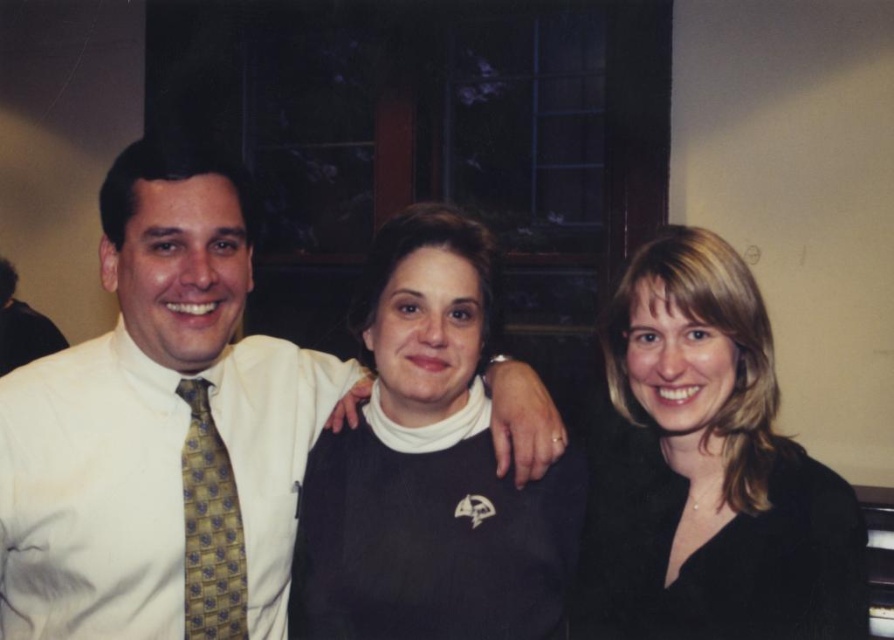
Question: Does yellowpatterned fabrictie at left appear over matte gold tie at left?

Choices:
 (A) no
 (B) yes

Answer: (A)

Question: Observing the image, what is the correct spatial positioning of white shirt at left in reference to black matte sweater at right?

Choices:
 (A) right
 (B) left

Answer: (B)

Question: Is black matte sweater at right to the left of yellowpatterned fabrictie at left from the viewer's perspective?

Choices:
 (A) yes
 (B) no

Answer: (B)

Question: Which is nearer to the black matte sweater at right?

Choices:
 (A) white shirt at left
 (B) matte gold tie at left
 (C) yellowpatterned fabrictie at left

Answer: (A)

Question: Which point is closer to the camera?

Choices:
 (A) white shirt at left
 (B) black sweater at center
 (C) yellowpatterned fabrictie at left
 (D) black matte sweater at right

Answer: (D)

Question: Which point is farther from the camera taking this photo?

Choices:
 (A) (4, 336)
 (B) (174, 456)

Answer: (A)